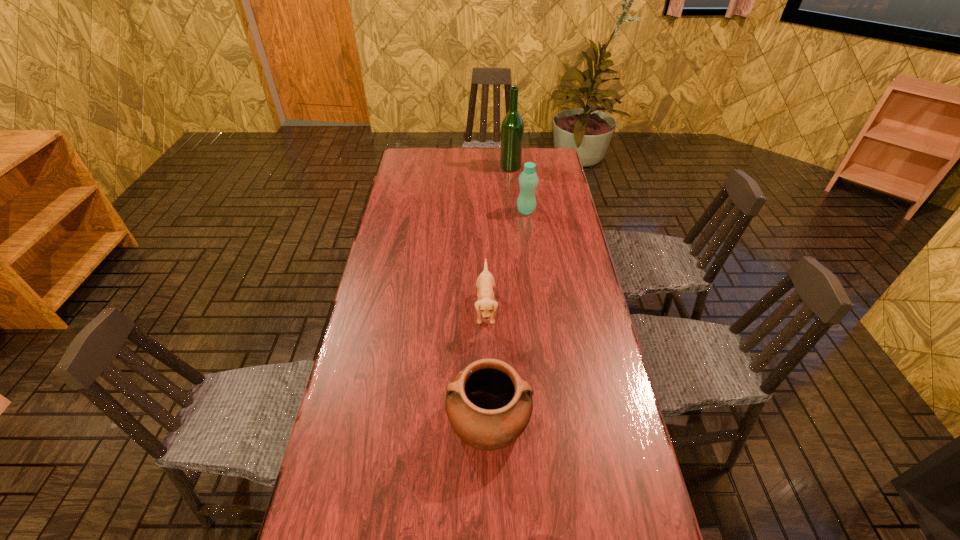
This screenshot has height=540, width=960. What are the coordinates of `free space between the third farthest object and the farthest object` in the screenshot? It's located at (498, 238).

What are the coordinates of `free space between the pottery and the alcohol` in the screenshot? It's located at (499, 294).

At what (x,y) coordinates should I click in order to perform the action: click on free spot between the nearest object and the second farthest object. Please return your answer as a coordinate pair (x, y). Image resolution: width=960 pixels, height=540 pixels. Looking at the image, I should click on (507, 315).

Image resolution: width=960 pixels, height=540 pixels. I want to click on empty location between the third nearest object and the alcohol, so click(x=518, y=189).

At what (x,y) coordinates should I click in order to perform the action: click on vacant space that is in between the second farthest object and the third tallest object. Please return your answer as a coordinate pair (x, y). Looking at the image, I should click on (507, 315).

Find the location of a particular element. object that is the second nearest to the shortest object is located at coordinates (528, 180).

Select which object appears as the closest to the farthest object. Please provide its 2D coordinates. Your answer should be formatted as a tuple, i.e. [(x, y)], where the tuple contains the x and y coordinates of a point satisfying the conditions above.

[(528, 180)]

I want to click on vacant space that satisfies the following two spatial constraints: 1. on the back side of the nearest object; 2. on the left side of the third shortest object, so click(x=486, y=211).

Where is `vacant space that satisfies the following two spatial constraints: 1. on the left side of the second nearest object; 2. on the right side of the third tallest object`? The width and height of the screenshot is (960, 540). vacant space that satisfies the following two spatial constraints: 1. on the left side of the second nearest object; 2. on the right side of the third tallest object is located at coordinates (487, 420).

Identify the location of free location that satisfies the following two spatial constraints: 1. on the left side of the third tallest object; 2. on the right side of the second nearest object. This screenshot has height=540, width=960. (487, 420).